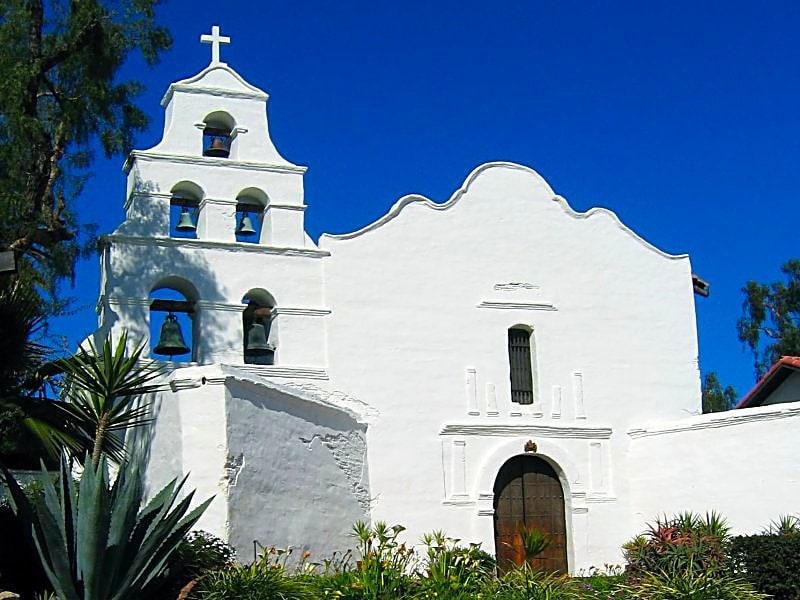
This screenshot has width=800, height=600. What are the coordinates of `door` in the screenshot? It's located at (533, 500).